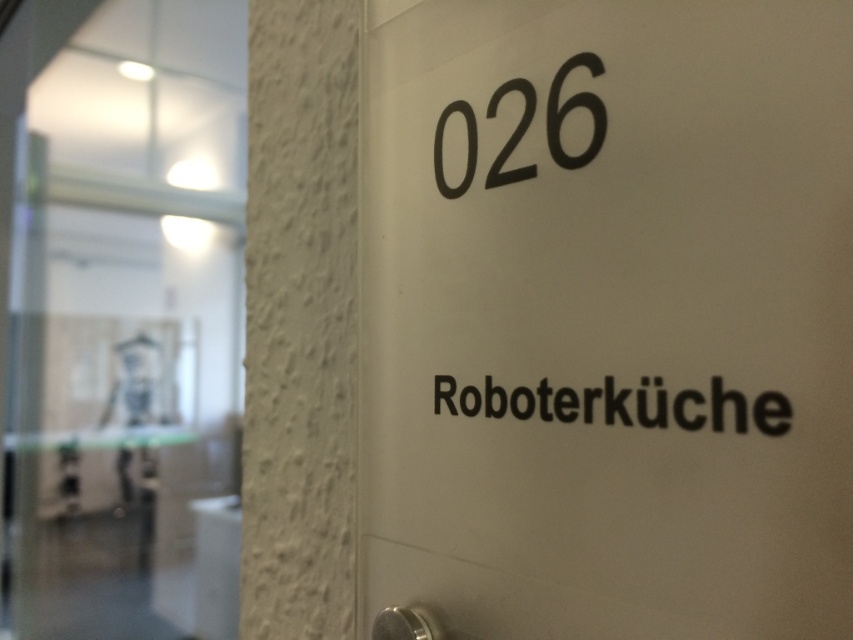
Question: Can you confirm if white matte sign at center is positioned above black matte number at upper center?

Choices:
 (A) no
 (B) yes

Answer: (A)

Question: Can you confirm if black matte text at center is positioned to the left of black matte number at upper center?

Choices:
 (A) yes
 (B) no

Answer: (B)

Question: Which object appears closest to the camera in this image?

Choices:
 (A) black matte text at center
 (B) white matte sign at center

Answer: (B)

Question: Among these points, which one is nearest to the camera?

Choices:
 (A) (560, 90)
 (B) (840, 461)
 (C) (686, 401)

Answer: (B)

Question: Does white matte sign at center appear on the left side of black matte text at center?

Choices:
 (A) no
 (B) yes

Answer: (B)

Question: Which point is farther to the camera?

Choices:
 (A) (753, 120)
 (B) (599, 122)

Answer: (B)